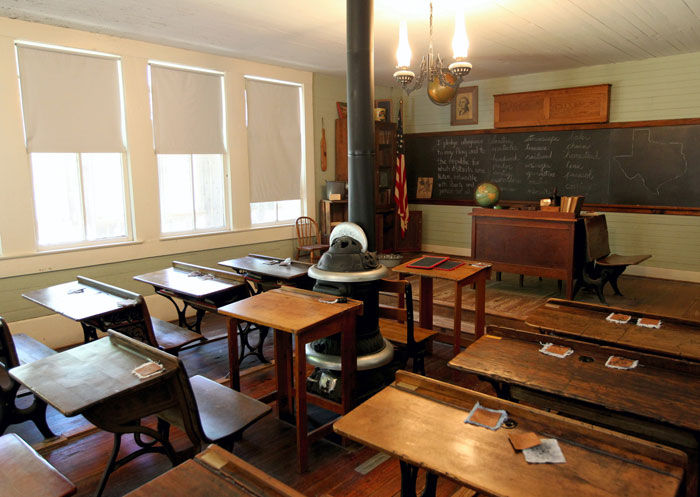
You are a GUI agent. You are given a task and a screenshot of the screen. Output one action in this format:
    pyautogui.click(x=<x>, y=<y>)
    Task: Click on the globe
    The width and height of the screenshot is (700, 497).
    Given the screenshot: What is the action you would take?
    pyautogui.click(x=484, y=200)